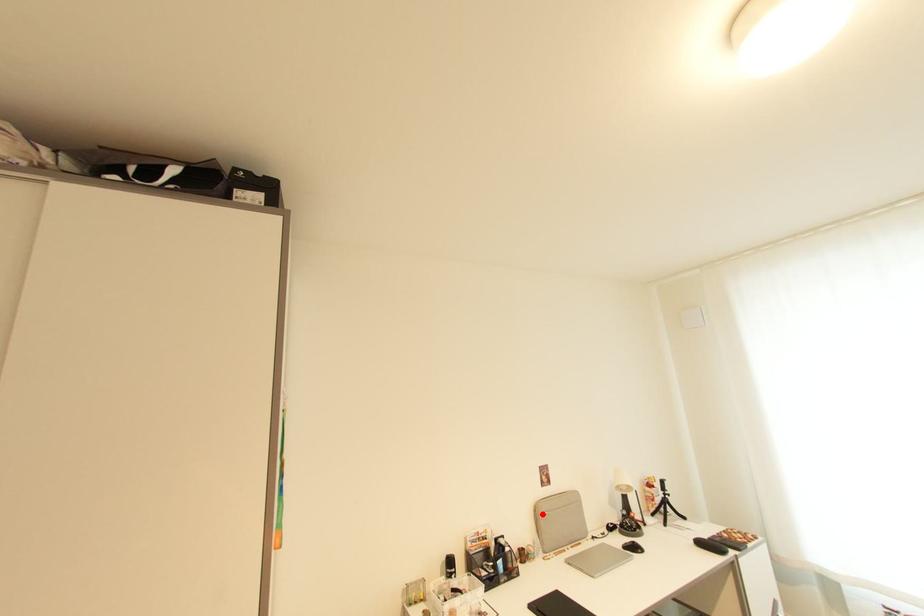
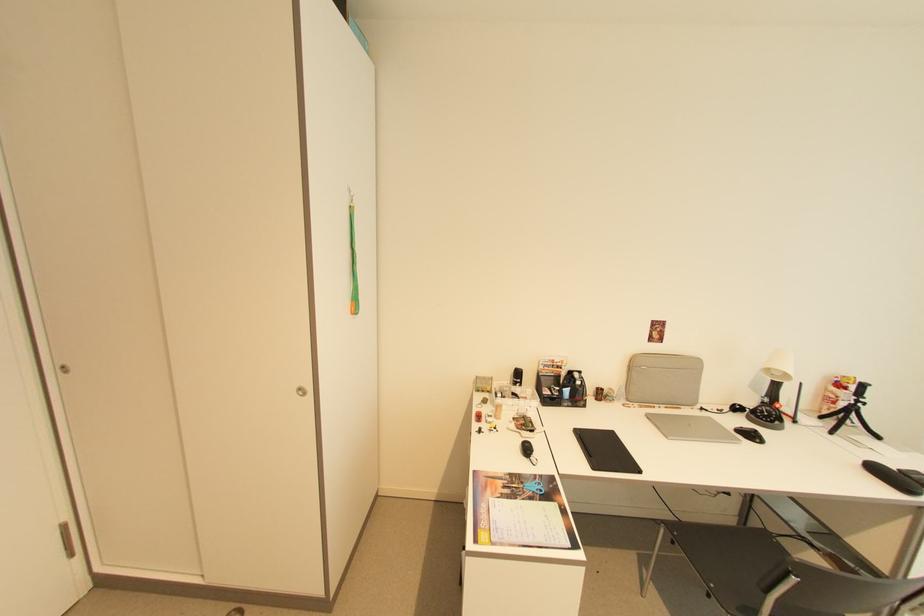
Find the pixel in the second image that matches the highlighted location in the first image.

(638, 366)